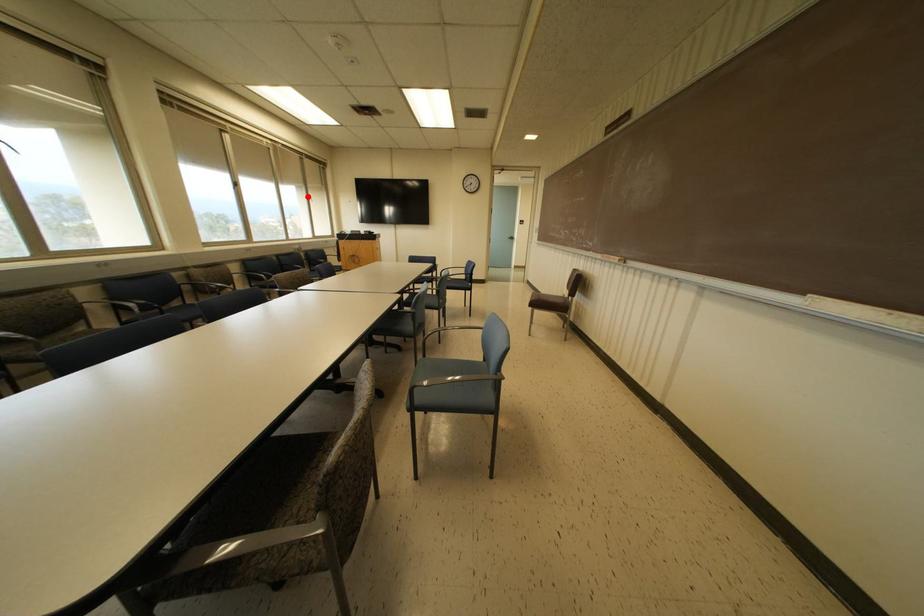
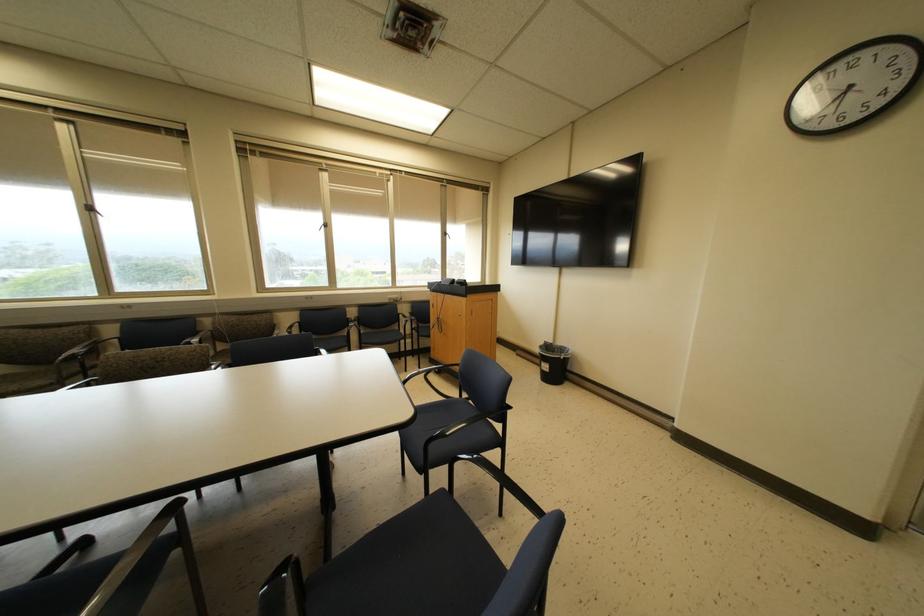
Find the pixel in the second image that matches the highlighted location in the first image.

(444, 233)